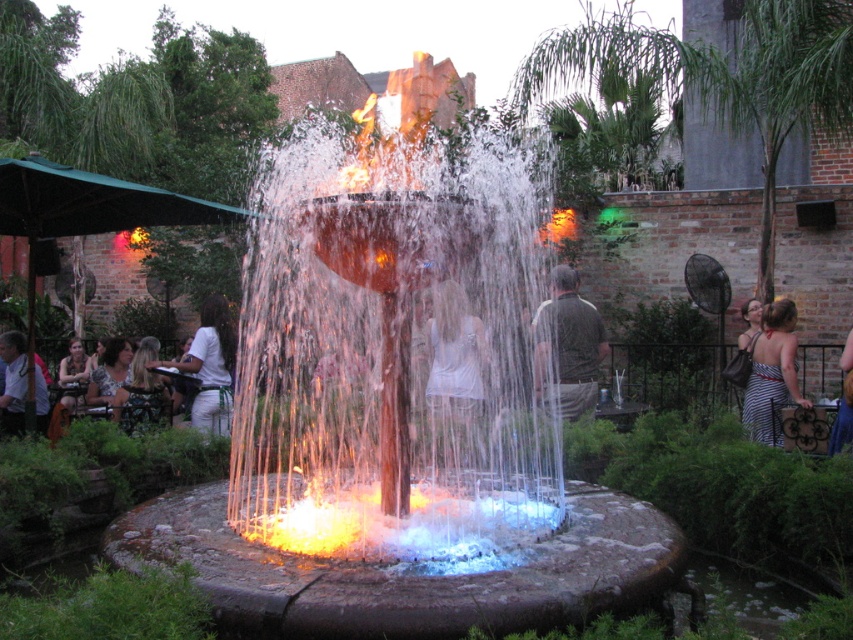
You are a photographer trying to capture both the translucent glass fire at center and the striped fabric dress at center in a single shot. Based on their sizes, which object should you focus on first to ensure both are in frame?

The translucent glass fire at center is larger than the striped fabric dress at center, so focus on the larger object first to ensure both fit within the frame.

You are standing at the center of the fountain and want to move towards the white fabric shirt at left. Which direction should you turn to face the light brown leather jacket at lower left?

The white fabric shirt at left is to the right of the light brown leather jacket at lower left, so to face the light brown leather jacket at lower left from the fountain center, you should turn left from the direction of the white fabric shirt at left.